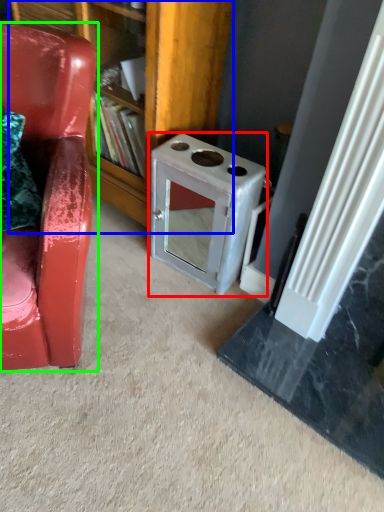
Question: Which is farther away from appliance (highlighted by a red box)? bookshelf (highlighted by a blue box) or chair (highlighted by a green box)?

Choices:
 (A) bookshelf
 (B) chair

Answer: (B)